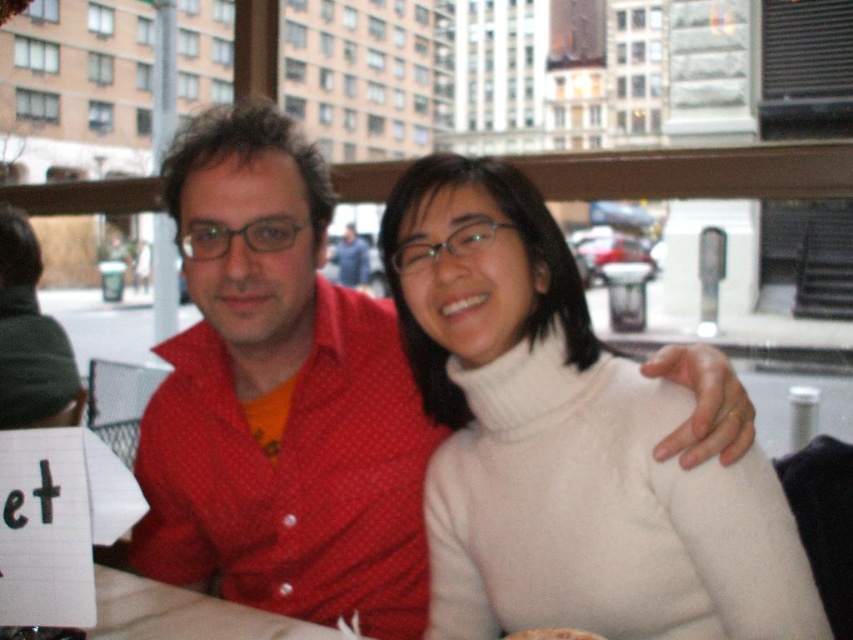
Question: Estimate the real-world distances between objects in this image. Which object is farther from the brown crumbly bread at center?

Choices:
 (A) red dotted shirt at center
 (B) white wool sweater at center

Answer: (A)

Question: Which point is farther to the camera?

Choices:
 (A) (616, 456)
 (B) (289, 545)
 (C) (503, 636)

Answer: (B)

Question: In this image, where is red dotted shirt at center located relative to brown crumbly bread at center?

Choices:
 (A) below
 (B) above

Answer: (B)

Question: Which point is closer to the camera?

Choices:
 (A) (194, 266)
 (B) (602, 636)

Answer: (B)

Question: Does red dotted shirt at center appear on the right side of brown crumbly bread at center?

Choices:
 (A) yes
 (B) no

Answer: (B)

Question: Is white wool sweater at center bigger than red dotted shirt at center?

Choices:
 (A) no
 (B) yes

Answer: (A)